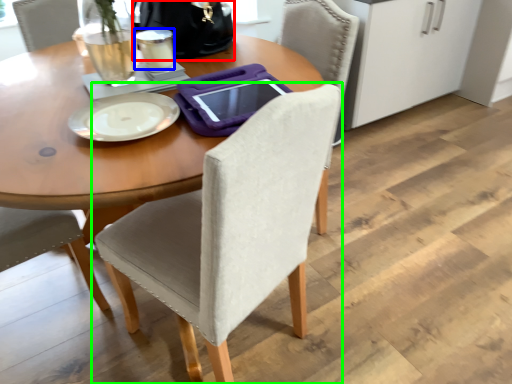
Question: Based on their relative distances, which object is farther from handbag (highlighted by a red box)? Choose from coffee cup (highlighted by a blue box) and chair (highlighted by a green box).

Choices:
 (A) coffee cup
 (B) chair

Answer: (B)